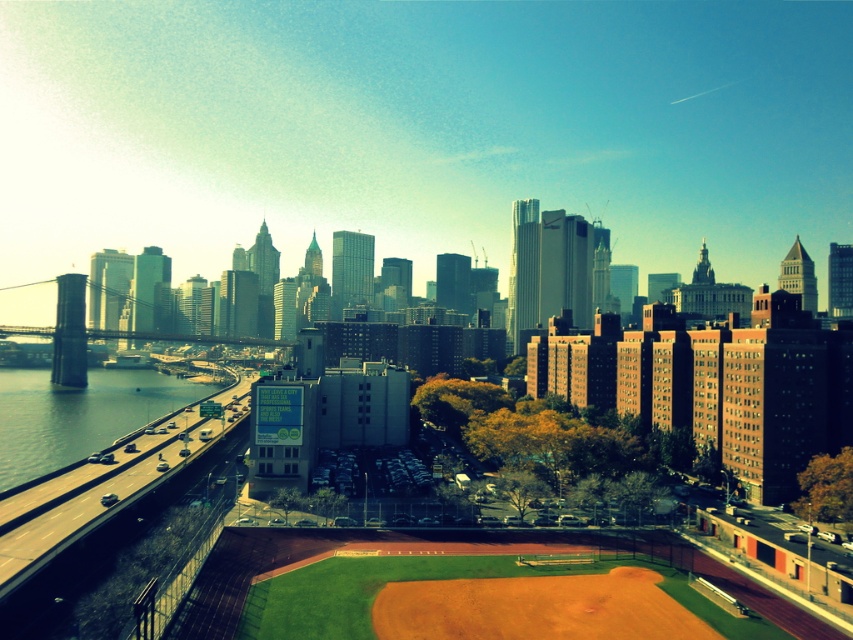
Who is positioned more to the left, brown dirt field at center or clear water at bridge left?

From the viewer's perspective, clear water at bridge left appears more on the left side.

Between point (822, 420) and point (96, 436), which one is positioned behind?

Positioned behind is point (96, 436).

At what (x,y) coordinates should I click in order to perform the action: click on brown dirt field at center. Please return your answer as a coordinate pair (x, y). Looking at the image, I should click on click(x=642, y=372).